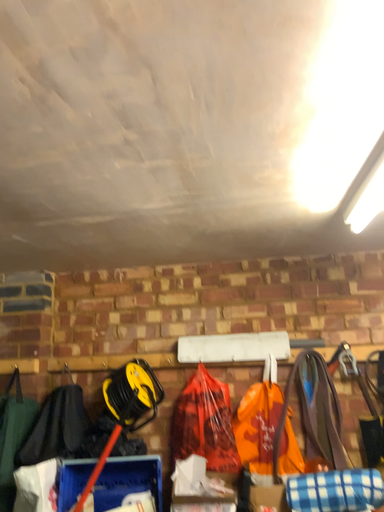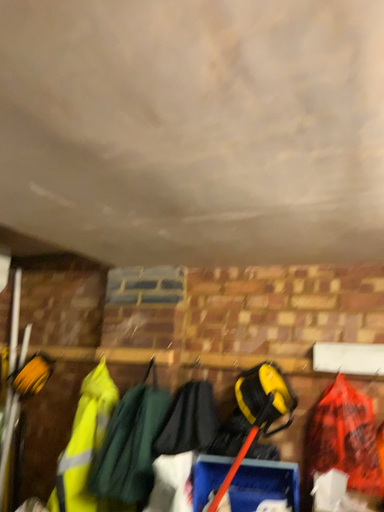
Question: Which way did the camera rotate in the video?

Choices:
 (A) rotated right
 (B) rotated left

Answer: (B)